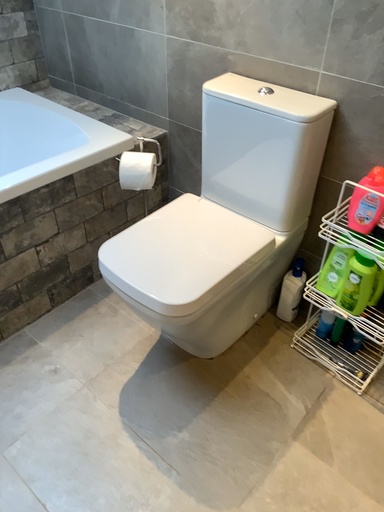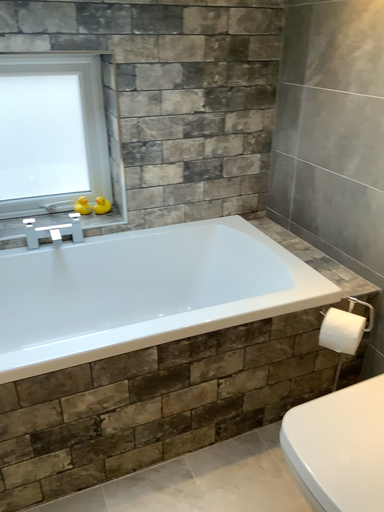
Question: How did the camera likely rotate when shooting the video?

Choices:
 (A) rotated upward
 (B) rotated downward

Answer: (A)